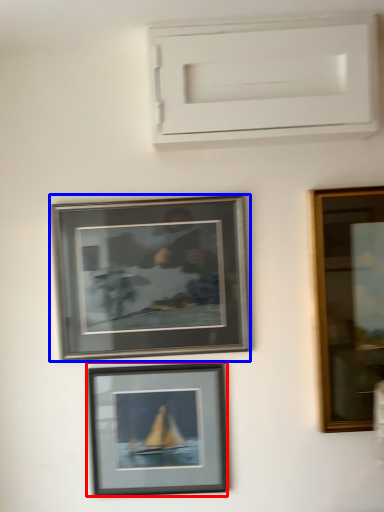
Question: Among these objects, which one is nearest to the camera, picture frame (highlighted by a red box) or picture frame (highlighted by a blue box)?

Choices:
 (A) picture frame
 (B) picture frame

Answer: (B)